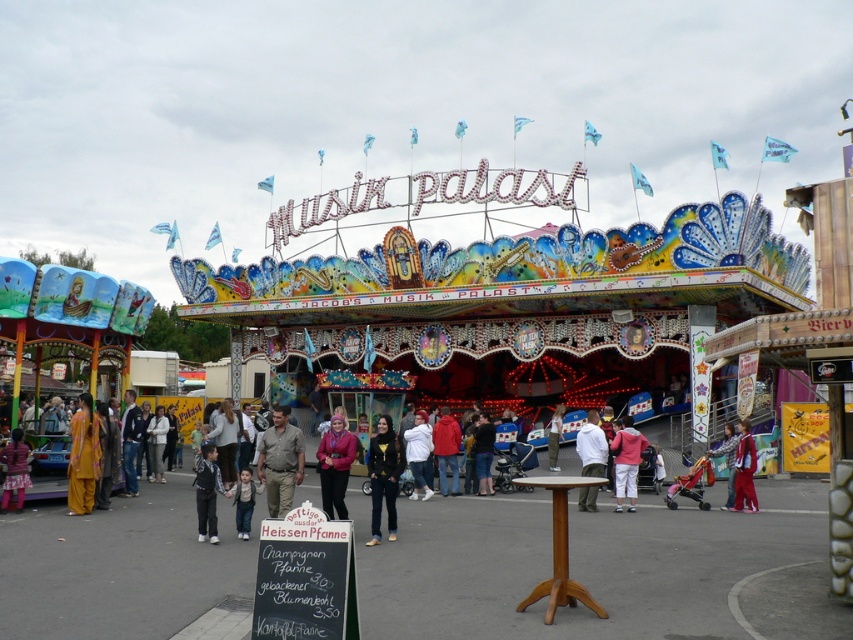
Does point (381, 477) lie in front of point (596, 456)?

Yes.

Where is `black leather jacket at center`? The width and height of the screenshot is (853, 640). black leather jacket at center is located at coordinates (383, 476).

Can you confirm if brown leather jacket at center is wider than light brown fabric pants at lower center?

Correct, the width of brown leather jacket at center exceeds that of light brown fabric pants at lower center.

Which is behind, point (292, 435) or point (247, 474)?

Point (292, 435)

Identify the location of brown leather jacket at center. (280, 461).

Is white matte jacket at center thinner than white cotton shirt at center?

Incorrect, white matte jacket at center's width is not less than white cotton shirt at center's.

Does white matte jacket at center have a larger size compared to white cotton shirt at center?

Yes.

What are the coordinates of `white matte jacket at center` in the screenshot? It's located at (592, 445).

Locate an element on the screen. Image resolution: width=853 pixels, height=640 pixels. white matte jacket at center is located at coordinates (592, 445).